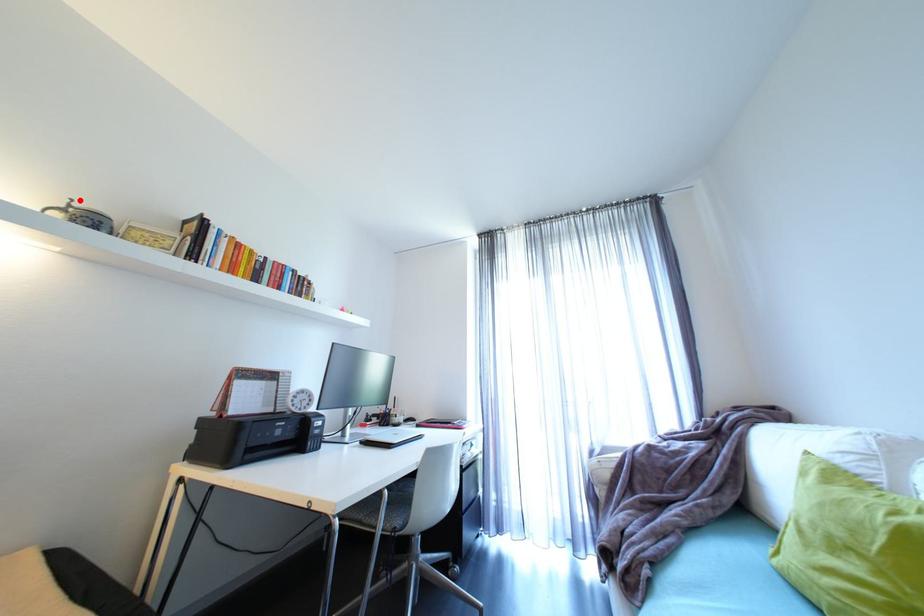
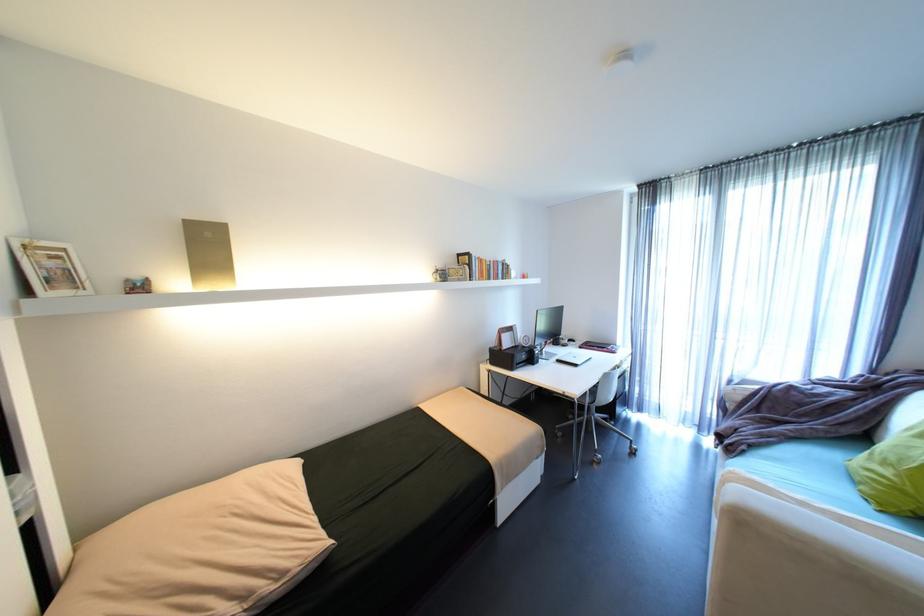
Find the pixel in the second image that matches the highlighted location in the first image.

(444, 267)